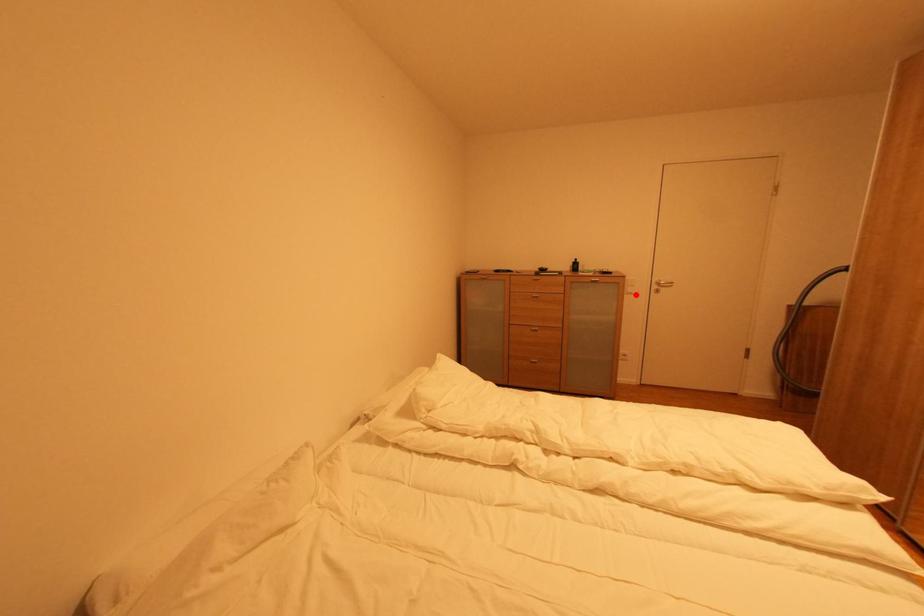
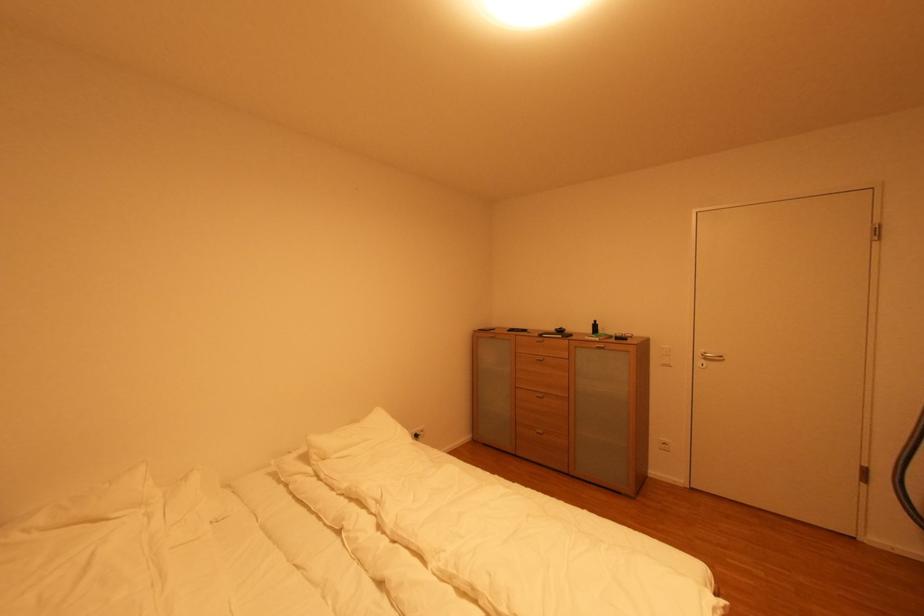
Question: I am providing you with two images of the same scene from different viewpoints. Given a red point in image1, look at the same physical point in image2. Is it:

Choices:
 (A) Closer to the viewpoint
 (B) Farther from the viewpoint

Answer: (B)